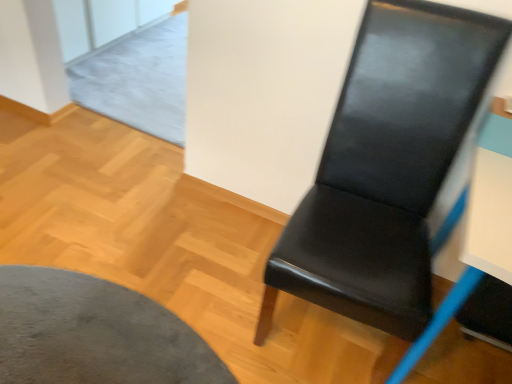
The image size is (512, 384). I want to click on free location to the left of black leather chair at right, so click(x=199, y=287).